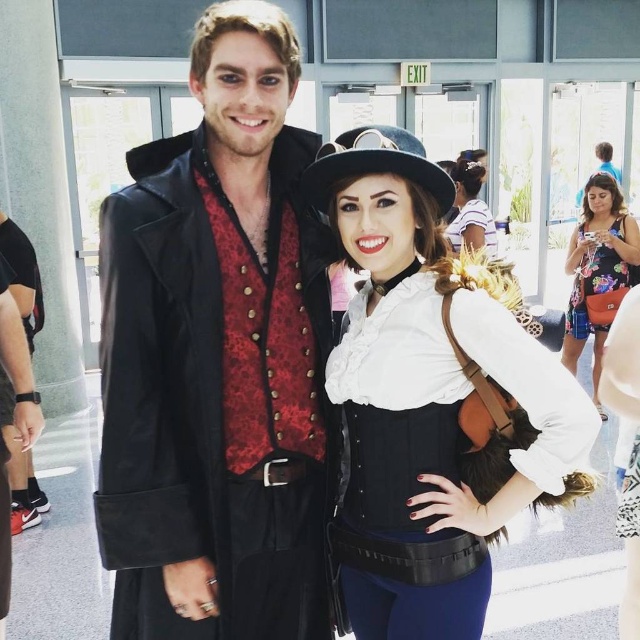
You are organizing a photoshoot and need to position the white matte shirt at center and the floral dress at right in a confined space. Which of the two items requires more physical space to accommodate?

The floral dress at right requires more physical space because it occupies more space than the white matte shirt at center.

You are standing in the same room as the two people in the image. You want to hand a gift to the person wearing the white matte shirt at center without approaching the matte black coat at center. Is this possible?

The matte black coat at center is closer to you than the white matte shirt at center. Since the matte black coat at center is between you and the white matte shirt at center, you can reach the white matte shirt at center without moving past the matte black coat at center if you extend your arm or move sideways.

You are a photographer setting up a shoot in this space. You need to position the white matte shirt at center and the floral dress at right so that both are visible in the frame. Considering their heights, which clothing item should be placed closer to the front to ensure both are fully visible?

The white matte shirt at center is shorter than the floral dress at right, so placing the white matte shirt at center closer to the front will ensure both are fully visible in the frame.